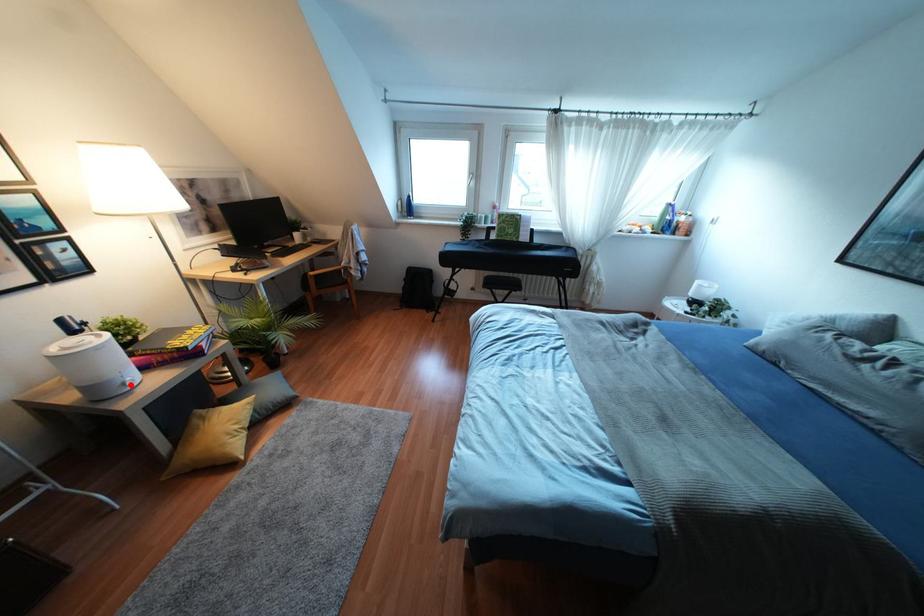
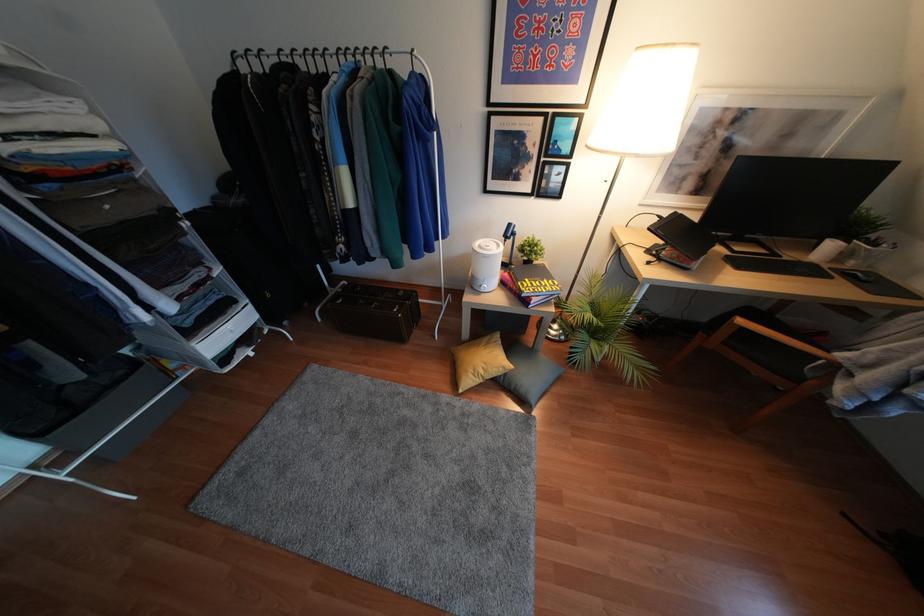
Question: A red point is marked in image1. In image2, is the corresponding 3D point closer to the camera or farther? Reply with the corresponding letter.

Choices:
 (A) The corresponding 3D point is closer.
 (B) The corresponding 3D point is farther.

Answer: (A)